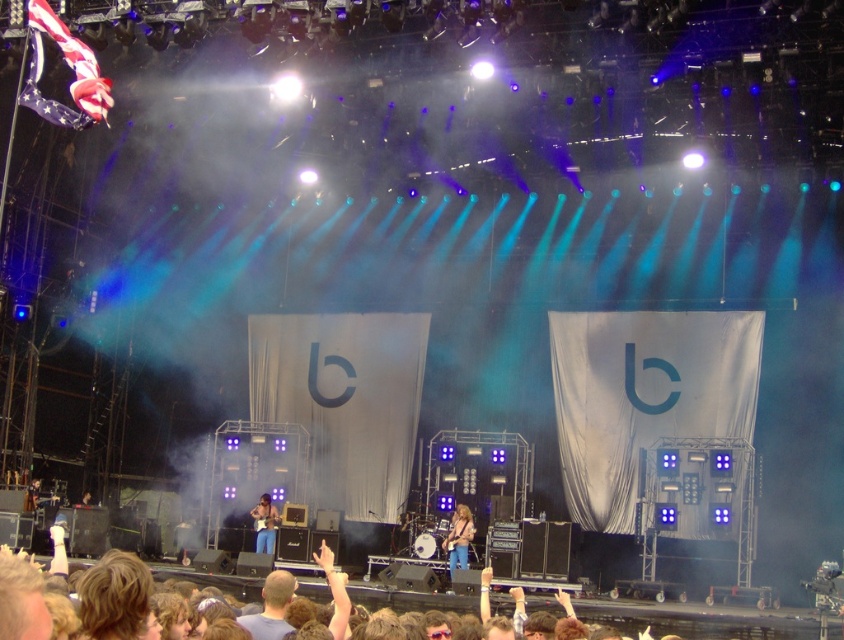
You are a photographer standing at the edge of the crowd. You want to take a photo of both the blue jeans at center and the blue denim jeans at center without any obstruction. Given that your camera has a minimum focus distance of 3 meters, will you be able to capture both subjects clearly in the same frame?

The distance between blue jeans at center and blue denim jeans at center is 3.17 meters. Since your camera requires a minimum focus distance of 3 meters, the 3.17 meters distance is sufficient to capture both subjects clearly in the same frame.

You are a photographer at the concert and need to capture a closeup of both the blue jeans at center and the blue denim jeans at center. Which pair of jeans should you focus on if you want to ensure they appear larger in the photo?

The blue jeans at center might appear larger in the photo since they are wider than the blue denim jeans at center.